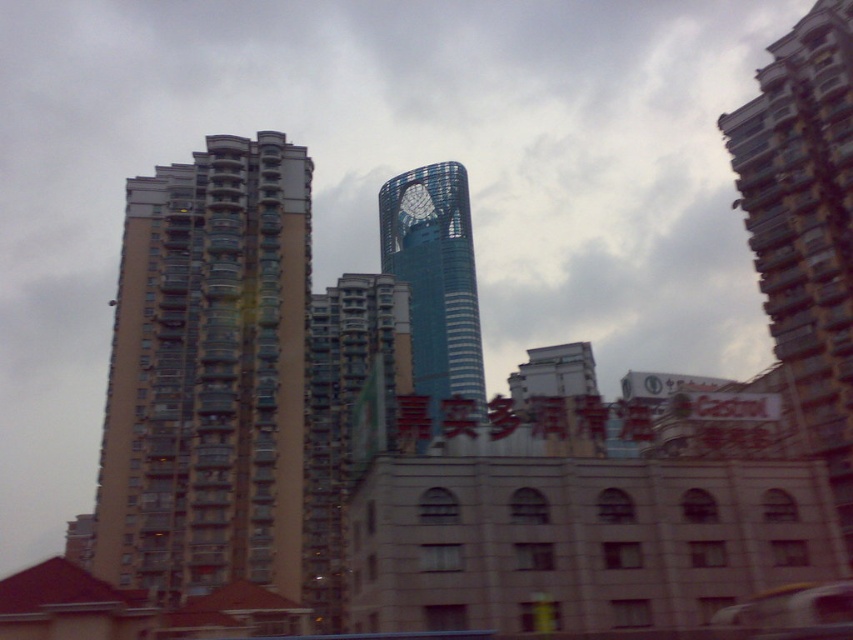
Does beige concrete building at left come in front of blue glassy tower at center?

That is False.

Between beige concrete building at left and blue glassy tower at center, which one appears on the left side from the viewer's perspective?

beige concrete building at left

Between point (151, 317) and point (463, 196), which one is positioned in front?

Point (151, 317)

At what (x,y) coordinates should I click in order to perform the action: click on beige concrete building at left. Please return your answer as a coordinate pair (x, y). The image size is (853, 640). Looking at the image, I should click on coord(207,376).